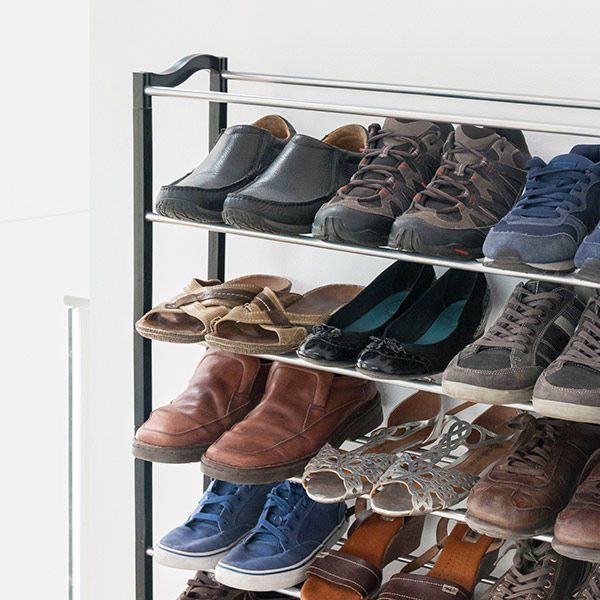
The width and height of the screenshot is (600, 600). Find the location of `shoes on 2nd shelf from the top`. shoes on 2nd shelf from the top is located at coordinates (558, 389), (490, 362), (426, 333), (374, 321), (305, 311), (216, 301).